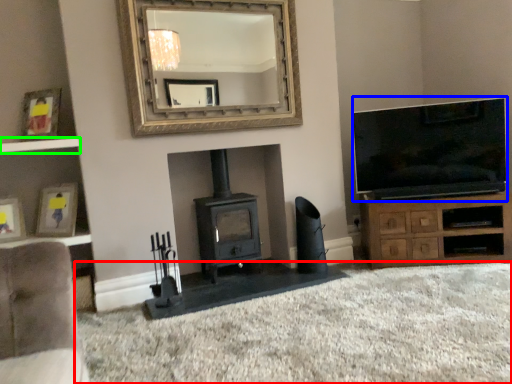
Question: Based on their relative distances, which object is farther from plain (highlighted by a red box)? Choose from television (highlighted by a blue box) and shelf (highlighted by a green box).

Choices:
 (A) television
 (B) shelf

Answer: (B)